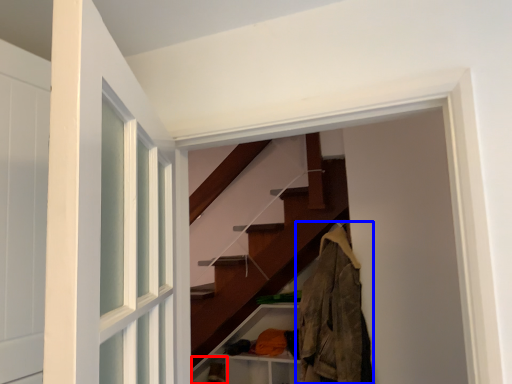
Question: Which object is further to the camera taking this photo, shelf (highlighted by a red box) or clothing (highlighted by a blue box)?

Choices:
 (A) shelf
 (B) clothing

Answer: (A)